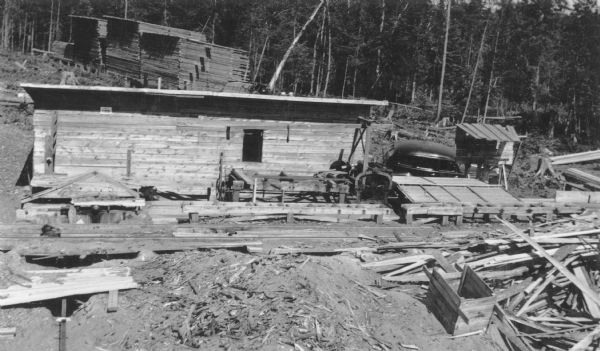
Where is `side windows`? side windows is located at coordinates (423, 158), (445, 161).